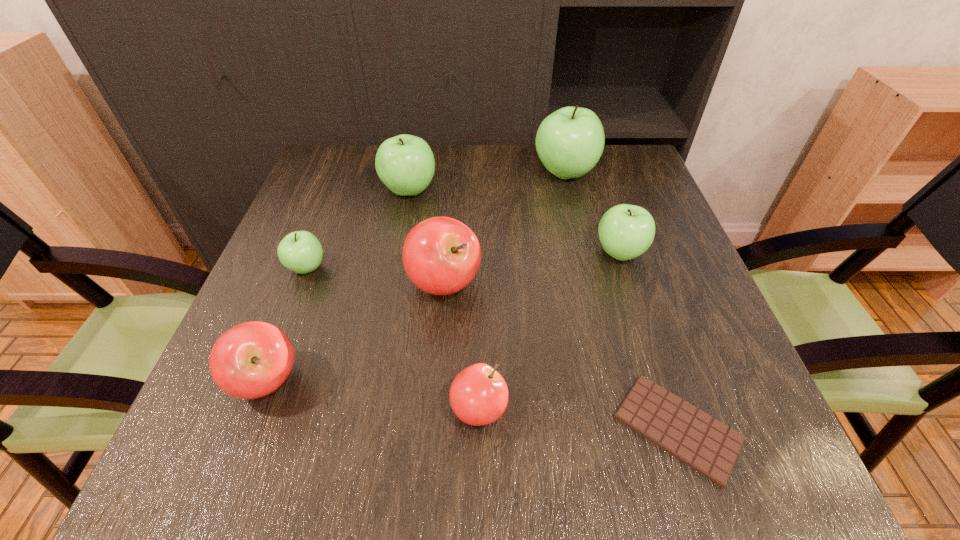
Locate which apple is the second closest to the second biggest green apple. Please provide its 2D coordinates. Your answer should be formatted as a tuple, i.e. [(x, y)], where the tuple contains the x and y coordinates of a point satisfying the conditions above.

[(300, 251)]

Identify the location of green apple identified as the fourth closest to the biggest red apple. (570, 141).

What are the coordinates of `green apple that stands as the third closest to the shortest object` in the screenshot? It's located at (405, 163).

Identify which red apple is the second closest to the biggest red apple. Please provide its 2D coordinates. Your answer should be formatted as a tuple, i.e. [(x, y)], where the tuple contains the x and y coordinates of a point satisfying the conditions above.

[(251, 360)]

Select which red apple is the closest to the smallest red apple. Please provide its 2D coordinates. Your answer should be formatted as a tuple, i.e. [(x, y)], where the tuple contains the x and y coordinates of a point satisfying the conditions above.

[(441, 255)]

Locate an element on the screen. free spot that satisfies the following two spatial constraints: 1. on the front side of the biggest red apple; 2. on the left side of the chocolate bar is located at coordinates (433, 428).

Where is `vacant region that satisfies the following two spatial constraints: 1. on the front side of the second green apple from left to right; 2. on the left side of the smallest red apple`? The height and width of the screenshot is (540, 960). vacant region that satisfies the following two spatial constraints: 1. on the front side of the second green apple from left to right; 2. on the left side of the smallest red apple is located at coordinates (367, 409).

Locate an element on the screen. This screenshot has height=540, width=960. vacant position in the image that satisfies the following two spatial constraints: 1. on the back side of the biggest red apple; 2. on the left side of the tallest object is located at coordinates (453, 173).

I want to click on free space that satisfies the following two spatial constraints: 1. on the back side of the smallest red apple; 2. on the right side of the tallest apple, so click(x=479, y=173).